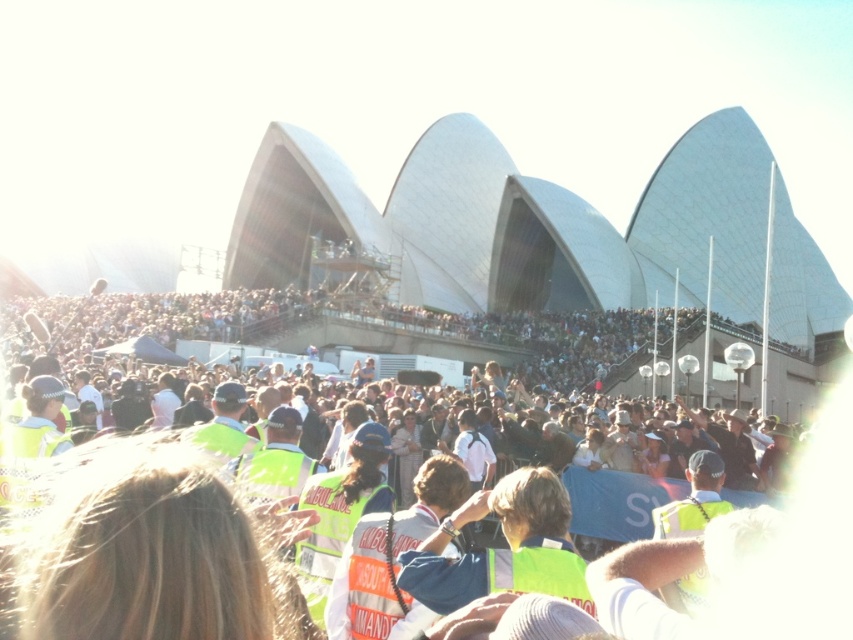
Which is more to the left, yellow reflective vest at center or neon yellow fabric safety vest at center?

Positioned to the left is neon yellow fabric safety vest at center.

Between yellow reflective vest at center and neon yellow fabric safety vest at center, which one is positioned higher?

Positioned higher is yellow reflective vest at center.

You are a GUI agent. You are given a task and a screenshot of the screen. Output one action in this format:
    pyautogui.click(x=<x>, y=<y>)
    Task: Click on the yellow reflective vest at center
    
    Given the screenshot: What is the action you would take?
    pyautogui.click(x=693, y=499)

Between point (253, 396) and point (457, 582), which one is positioned behind?

Positioned behind is point (253, 396).

Locate an element on the screen. This screenshot has width=853, height=640. yellow reflective vests at center is located at coordinates (553, 449).

The width and height of the screenshot is (853, 640). In order to click on yellow reflective vests at center in this screenshot , I will do `click(553, 449)`.

Does reflective orange safety vest at center have a greater width compared to yellow reflective vest at center?

No.

Is reflective orange safety vest at center to the left of yellow reflective vest at center from the viewer's perspective?

Yes, reflective orange safety vest at center is to the left of yellow reflective vest at center.

Is point (318, 497) less distant than point (699, 458)?

Yes, point (318, 497) is in front of point (699, 458).

Where is `reflective orange safety vest at center`? The width and height of the screenshot is (853, 640). reflective orange safety vest at center is located at coordinates (328, 532).